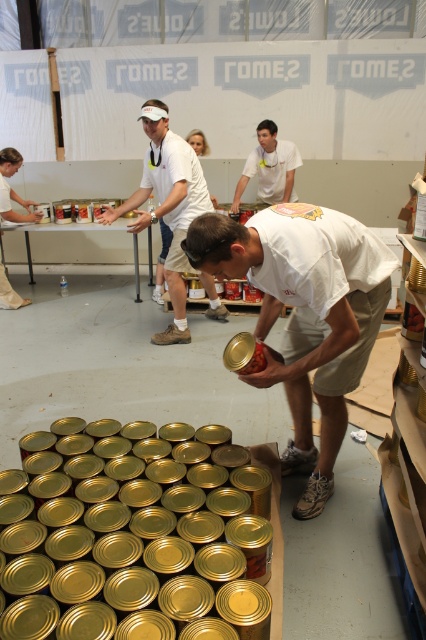
Question: Which object is farther from the camera taking this photo?

Choices:
 (A) white matte shirt at center
 (B) shiny metallic can at center

Answer: (A)

Question: Is white matte shirt at center positioned at the back of gold metallic can at center?

Choices:
 (A) yes
 (B) no

Answer: (A)

Question: Is matte white shirt at center behind shiny metallic can at center?

Choices:
 (A) no
 (B) yes

Answer: (A)

Question: Among these points, which one is nearest to the camera?

Choices:
 (A) (261, 353)
 (B) (409, 323)

Answer: (A)

Question: Which point appears closest to the camera in this image?

Choices:
 (A) (247, 360)
 (B) (408, 320)

Answer: (A)

Question: Does matte white shirt at center appear under shiny metallic can at center?

Choices:
 (A) no
 (B) yes

Answer: (B)